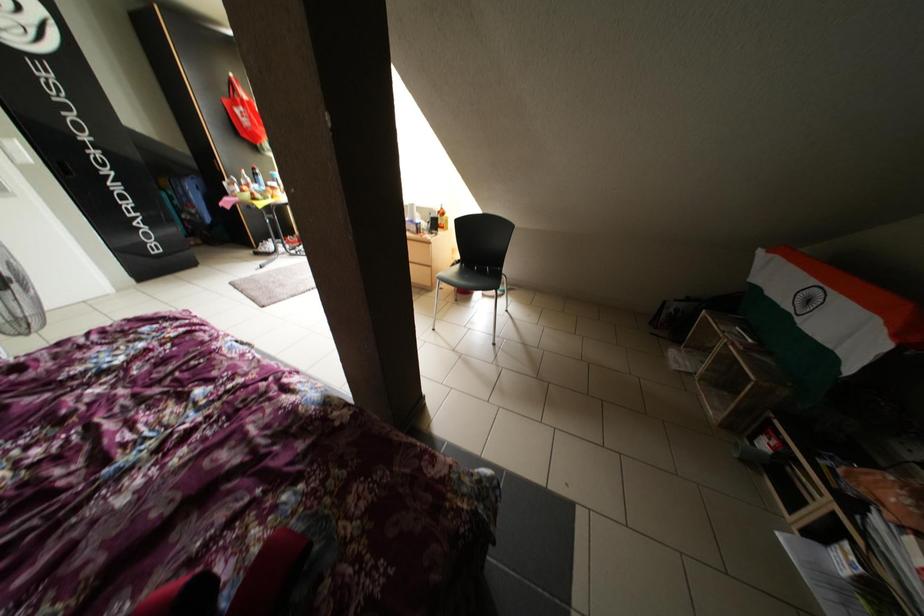
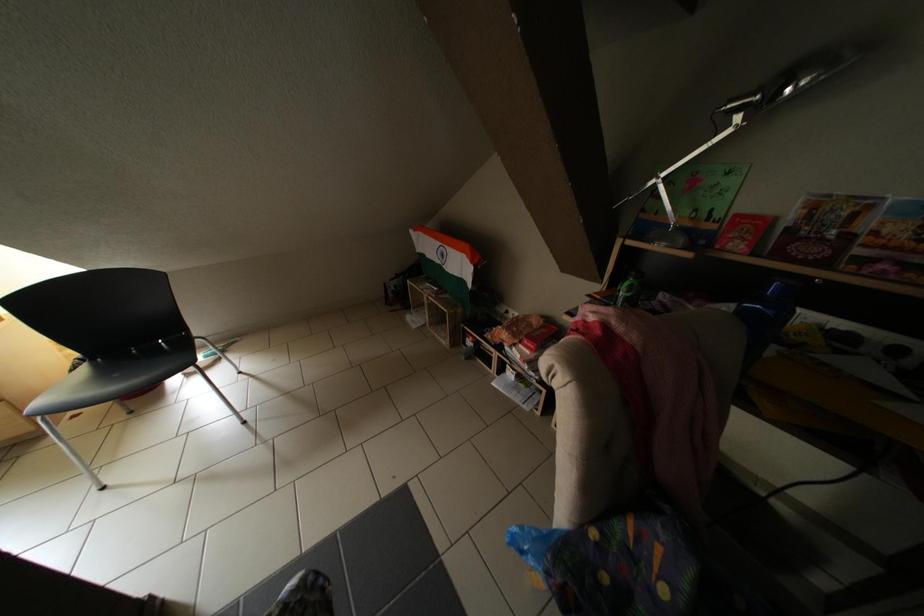
Question: The images are taken continuously from a first-person perspective. In which direction is your viewpoint rotating?

Choices:
 (A) Left
 (B) Right
 (C) Up
 (D) Down

Answer: (B)